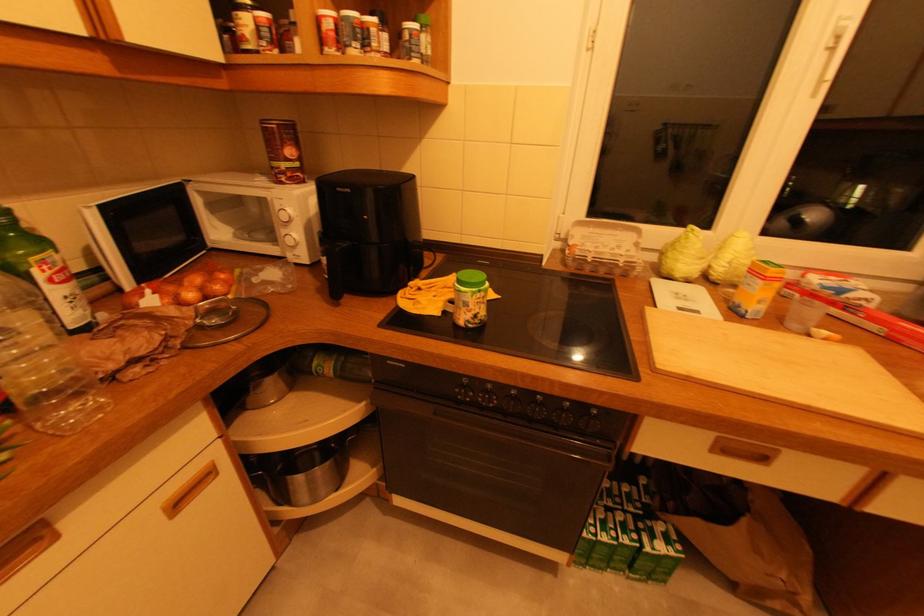
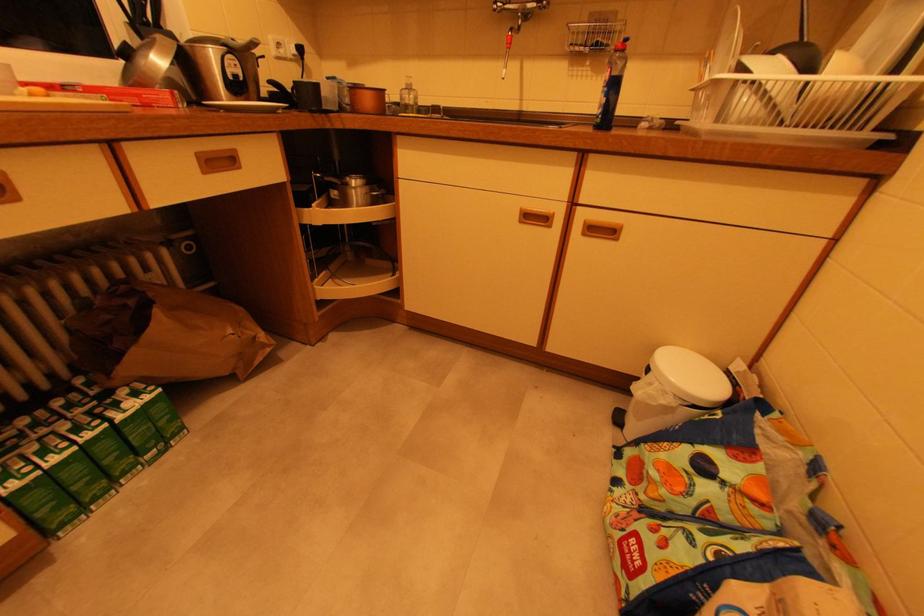
First-person continuous shooting, in which direction is the camera rotating?

The camera's rotation is toward right-down.